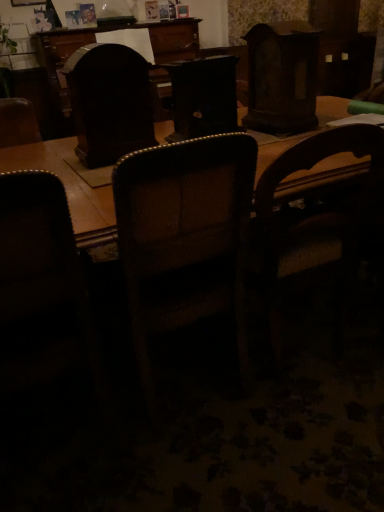
This screenshot has width=384, height=512. What are the coordinates of `vacant space in front of dark wood swivel chair at center` in the screenshot? It's located at (89, 176).